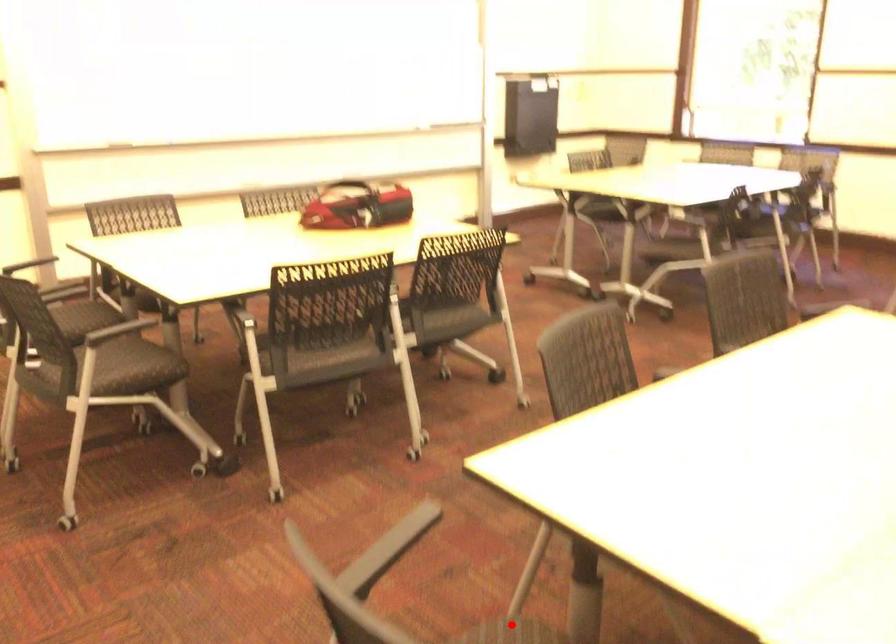
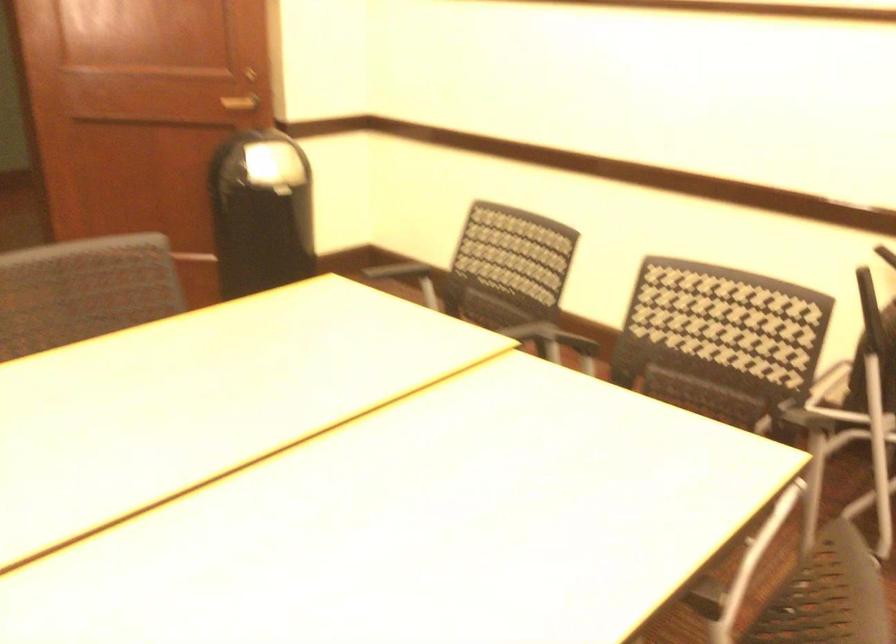
Question: I am providing you with two images of the same scene from different viewpoints. A red point is marked on the first image. Is the red point's position out of view in image 2?

Choices:
 (A) Yes
 (B) No

Answer: (A)